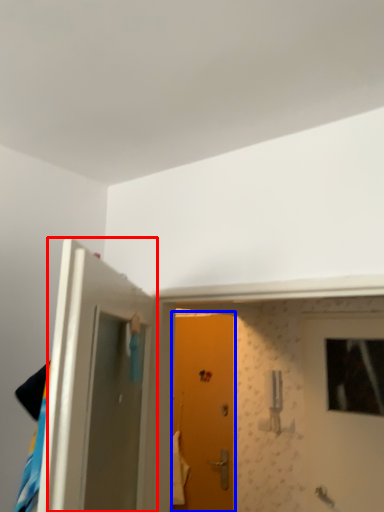
Question: Among these objects, which one is farthest to the camera, door (highlighted by a red box) or door (highlighted by a blue box)?

Choices:
 (A) door
 (B) door

Answer: (B)